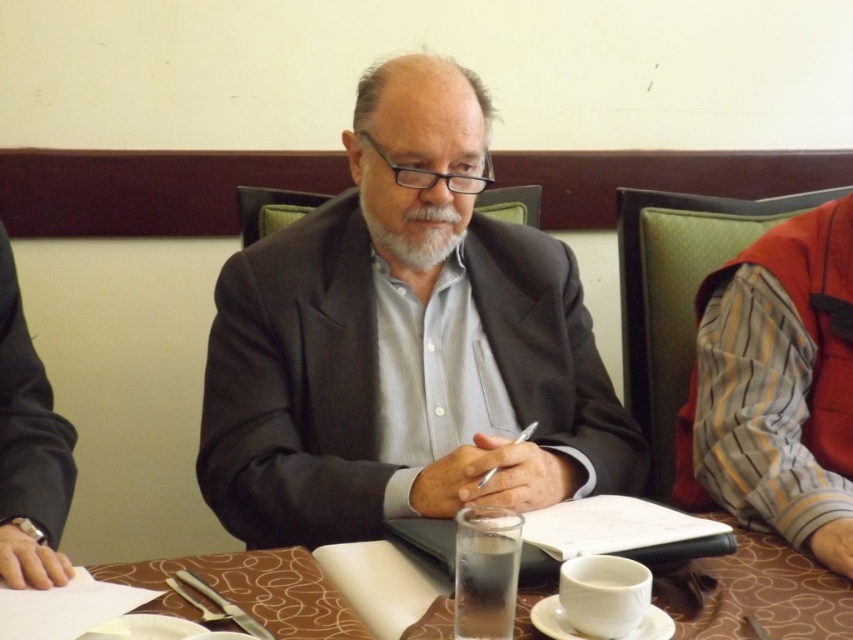
Which is in front, point (376, 474) or point (61, 499)?

Point (61, 499)

Is point (584, 330) more distant than point (68, 488)?

Yes.

Who is more forward, (389, 419) or (22, 412)?

Point (22, 412) is more forward.

You are a GUI agent. You are given a task and a screenshot of the screen. Output one action in this format:
    pyautogui.click(x=<x>, y=<y>)
    Task: Click on the matte gray suit at center
    Image resolution: width=853 pixels, height=640 pixels.
    Given the screenshot: What is the action you would take?
    pyautogui.click(x=402, y=348)

Between black smooth suit at left and white matte beard at center, which one appears on the right side from the viewer's perspective?

From the viewer's perspective, white matte beard at center appears more on the right side.

Can you confirm if black smooth suit at left is taller than white matte beard at center?

Correct, black smooth suit at left is much taller as white matte beard at center.

Find the location of a particular element. This screenshot has width=853, height=640. black smooth suit at left is located at coordinates (28, 422).

This screenshot has width=853, height=640. Find the location of `black smooth suit at left`. black smooth suit at left is located at coordinates (28, 422).

Who is more distant from viewer, (611, 570) or (373, 218)?

Positioned behind is point (373, 218).

Does point (585, 579) come in front of point (434, 252)?

Yes.

This screenshot has height=640, width=853. In order to click on white ceramic cup at center in this screenshot , I will do `click(602, 593)`.